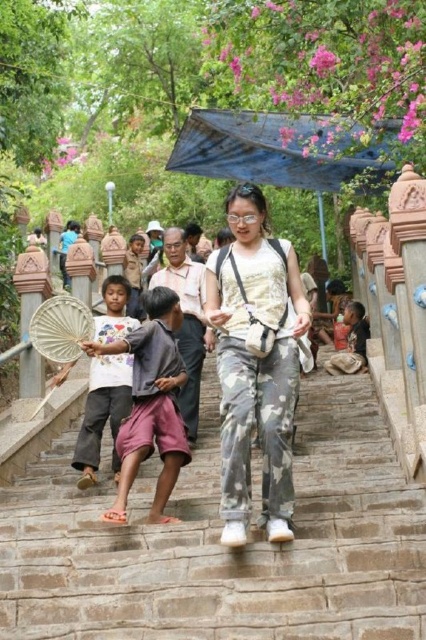
Question: Among these points, which one is farthest from the camera?

Choices:
 (A) (356, 349)
 (B) (141, 406)
 (C) (123, 392)
 (D) (55, 308)

Answer: (A)

Question: Estimate the real-world distances between objects in this image. Which object is closer to the white paper fan at left?

Choices:
 (A) stone stairs at center
 (B) camo pants at center
 (C) pink cotton shorts at lower center
 (D) wooden fan at center

Answer: (D)

Question: Considering the real-world distances, which object is closest to the wooden fan at center?

Choices:
 (A) stone stairs at center
 (B) camo pants at center

Answer: (B)

Question: Can you confirm if wooden fan at center is thinner than brown cotton shirt at lower right?

Choices:
 (A) yes
 (B) no

Answer: (B)

Question: Does stone stairs at center have a lesser width compared to white paper fan at left?

Choices:
 (A) yes
 (B) no

Answer: (B)

Question: Can you confirm if camo pants at center is positioned above wooden fan at center?

Choices:
 (A) no
 (B) yes

Answer: (A)